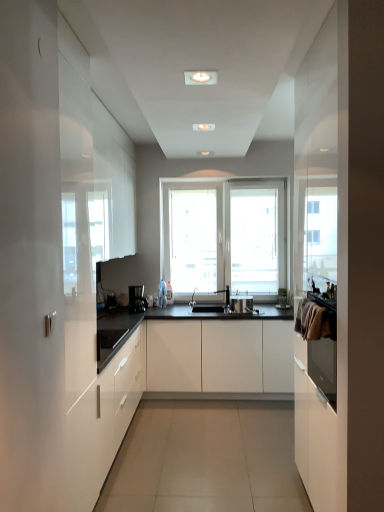
Locate an element on the screen. This screenshot has height=512, width=384. black plastic coffee machine at center is located at coordinates (137, 298).

Locate an element on the screen. This screenshot has width=384, height=512. satin silver toaster at center is located at coordinates 241,304.

You are a GUI agent. You are given a task and a screenshot of the screen. Output one action in this format:
    pyautogui.click(x=<x>, y=<y>)
    Task: Click on the black plastic coffee machine at center
    Image resolution: width=384 pixels, height=512 pixels.
    Given the screenshot: What is the action you would take?
    pyautogui.click(x=137, y=298)

Is white glossy cabinet at left, marked as the second cabinetry in a right-to-left arrangement, wider than satin silver toaster at center?

Indeed, white glossy cabinet at left, marked as the second cabinetry in a right-to-left arrangement, has a greater width compared to satin silver toaster at center.

Between white glossy cabinet at left, the 1th cabinetry in the left-to-right sequence, and satin silver toaster at center, which one has less height?

Standing shorter between the two is satin silver toaster at center.

Is point (92, 416) positioned after point (236, 300)?

No, (92, 416) is closer to viewer.

From the image's perspective, is black plastic coffee machine at center over white glossy cabinet at left, marked as the second cabinetry in a right-to-left arrangement?

Yes, from the image's perspective, black plastic coffee machine at center is over white glossy cabinet at left, marked as the second cabinetry in a right-to-left arrangement.

You are a GUI agent. You are given a task and a screenshot of the screen. Output one action in this format:
    pyautogui.click(x=<x>, y=<y>)
    Task: Click on the cabinetry that is the 2nd one when counting forward from the black plastic coffee machine at center
    This screenshot has width=384, height=512.
    Given the screenshot: What is the action you would take?
    pyautogui.click(x=104, y=420)

In terms of width, does black plastic coffee machine at center look wider or thinner when compared to white glossy cabinet at left, the 1th cabinetry in the left-to-right sequence?

black plastic coffee machine at center is thinner than white glossy cabinet at left, the 1th cabinetry in the left-to-right sequence.

Is satin silver toaster at center not inside white glossy cabinet at left, marked as the second cabinetry in a right-to-left arrangement?

Yes, satin silver toaster at center is not within white glossy cabinet at left, marked as the second cabinetry in a right-to-left arrangement.

From the image's perspective, relative to white glossy cabinet at left, marked as the second cabinetry in a right-to-left arrangement, is satin silver toaster at center above or below?

satin silver toaster at center is above white glossy cabinet at left, marked as the second cabinetry in a right-to-left arrangement.

From a real-world perspective, relative to white glossy cabinet at left, the 1th cabinetry in the left-to-right sequence, is satin silver toaster at center vertically above or below?

satin silver toaster at center is situated higher than white glossy cabinet at left, the 1th cabinetry in the left-to-right sequence, in the real world.

Is white matte cabinet at center, which is the first cabinetry in right-to-left order, closer to the viewer compared to black plastic coffee machine at center?

Yes, white matte cabinet at center, which is the first cabinetry in right-to-left order, is closer to the camera.

Is white matte cabinet at center, which is the second cabinetry in left-to-right order, aimed at black plastic coffee machine at center?

No, white matte cabinet at center, which is the second cabinetry in left-to-right order, is not facing towards black plastic coffee machine at center.

Considering the positions of objects white matte cabinet at center, which is the first cabinetry in right-to-left order, and black plastic coffee machine at center in the image provided, who is more to the left, white matte cabinet at center, which is the first cabinetry in right-to-left order, or black plastic coffee machine at center?

Positioned to the left is black plastic coffee machine at center.

Based on the photo, is white glossy cabinet at left, marked as the second cabinetry in a right-to-left arrangement, inside white matte cabinet at center, which is the second cabinetry in left-to-right order?

No, white glossy cabinet at left, marked as the second cabinetry in a right-to-left arrangement, is not a part of white matte cabinet at center, which is the second cabinetry in left-to-right order.

Between white matte cabinet at center, which is the first cabinetry in right-to-left order, and white glossy cabinet at left, the 1th cabinetry in the left-to-right sequence, which one is positioned behind?

white matte cabinet at center, which is the first cabinetry in right-to-left order, is further from the camera.

Considering the positions of points (151, 378) and (79, 486), is point (151, 378) closer to camera compared to point (79, 486)?

That is False.

Which object is positioned more to the right, white matte cabinet at center, which is the first cabinetry in right-to-left order, or white glossy cabinet at left, marked as the second cabinetry in a right-to-left arrangement?

Positioned to the right is white matte cabinet at center, which is the first cabinetry in right-to-left order.

Considering the sizes of objects white glossy cabinet at left, the 1th cabinetry in the left-to-right sequence, and white matte cabinet at center, which is the first cabinetry in right-to-left order, in the image provided, who is thinner, white glossy cabinet at left, the 1th cabinetry in the left-to-right sequence, or white matte cabinet at center, which is the first cabinetry in right-to-left order,?

With smaller width is white glossy cabinet at left, the 1th cabinetry in the left-to-right sequence.

Consider the image. Between white glossy cabinet at left, the 1th cabinetry in the left-to-right sequence, and white matte cabinet at center, which is the second cabinetry in left-to-right order, which one has smaller size?

With smaller size is white glossy cabinet at left, the 1th cabinetry in the left-to-right sequence.

Does point (115, 392) appear closer or farther from the camera than point (205, 326)?

Clearly, point (115, 392) is closer to the camera than point (205, 326).

Is white glossy cabinet at left, the 1th cabinetry in the left-to-right sequence, with white matte cabinet at center, which is the first cabinetry in right-to-left order?

No, white glossy cabinet at left, the 1th cabinetry in the left-to-right sequence, is not next to white matte cabinet at center, which is the first cabinetry in right-to-left order.

Is point (246, 298) positioned in front of point (139, 296)?

No, (246, 298) is behind (139, 296).

Which of these two, satin silver toaster at center or black plastic coffee machine at center, is wider?

satin silver toaster at center is wider.

In terms of size, does satin silver toaster at center appear bigger or smaller than black plastic coffee machine at center?

In the image, satin silver toaster at center appears to be larger than black plastic coffee machine at center.

Locate an element on the screen. The height and width of the screenshot is (512, 384). appliance lying on the right of white glossy cabinet at left, marked as the second cabinetry in a right-to-left arrangement is located at coordinates (241, 304).

At what (x,y) coordinates should I click in order to perform the action: click on cabinetry that is the 1st object directly below the black plastic coffee machine at center (from a real-world perspective). Please return your answer as a coordinate pair (x, y). Looking at the image, I should click on (104, 420).

Which object lies nearer to the anchor point black plastic coffee machine at center, satin silver toaster at center or white matte cabinet at center, which is the first cabinetry in right-to-left order?

white matte cabinet at center, which is the first cabinetry in right-to-left order.

Based on their spatial positions, is white glossy cabinet at left, the 1th cabinetry in the left-to-right sequence, or white matte cabinet at center, which is the second cabinetry in left-to-right order, further from black plastic coffee machine at center?

Based on the image, white glossy cabinet at left, the 1th cabinetry in the left-to-right sequence, appears to be further to black plastic coffee machine at center.

Which object lies nearer to the anchor point white matte cabinet at center, which is the first cabinetry in right-to-left order, satin silver toaster at center or black plastic coffee machine at center?

satin silver toaster at center.

Based on their spatial positions, is white matte cabinet at center, which is the second cabinetry in left-to-right order, or satin silver toaster at center closer to white glossy cabinet at left, the 1th cabinetry in the left-to-right sequence?

The object closer to white glossy cabinet at left, the 1th cabinetry in the left-to-right sequence, is white matte cabinet at center, which is the second cabinetry in left-to-right order.

Considering their positions, is white glossy cabinet at left, marked as the second cabinetry in a right-to-left arrangement, positioned closer to satin silver toaster at center than white matte cabinet at center, which is the second cabinetry in left-to-right order?

white matte cabinet at center, which is the second cabinetry in left-to-right order, is positioned closer to the anchor satin silver toaster at center.

When comparing their distances from satin silver toaster at center, does black plastic coffee machine at center or white glossy cabinet at left, the 1th cabinetry in the left-to-right sequence, seem further?

white glossy cabinet at left, the 1th cabinetry in the left-to-right sequence.

Based on their spatial positions, is black plastic coffee machine at center or white matte cabinet at center, which is the second cabinetry in left-to-right order, closer to satin silver toaster at center?

white matte cabinet at center, which is the second cabinetry in left-to-right order, is closer to satin silver toaster at center.

Estimate the real-world distances between objects in this image. Which object is closer to black plastic coffee machine at center, white matte cabinet at center, which is the second cabinetry in left-to-right order, or white glossy cabinet at left, the 1th cabinetry in the left-to-right sequence?

white matte cabinet at center, which is the second cabinetry in left-to-right order, lies closer to black plastic coffee machine at center than the other object.

Where is `cabinetry positioned between white glossy cabinet at left, marked as the second cabinetry in a right-to-left arrangement, and black plastic coffee machine at center from near to far`? The height and width of the screenshot is (512, 384). cabinetry positioned between white glossy cabinet at left, marked as the second cabinetry in a right-to-left arrangement, and black plastic coffee machine at center from near to far is located at coordinates pyautogui.click(x=220, y=356).

The width and height of the screenshot is (384, 512). What are the coordinates of `appliance positioned between white glossy cabinet at left, the 1th cabinetry in the left-to-right sequence, and black plastic coffee machine at center from near to far` in the screenshot? It's located at pyautogui.click(x=241, y=304).

Locate an element on the screen. cabinetry between black plastic coffee machine at center and satin silver toaster at center in the horizontal direction is located at coordinates (220, 356).

Where is `cabinetry between white glossy cabinet at left, marked as the second cabinetry in a right-to-left arrangement, and satin silver toaster at center from front to back`? cabinetry between white glossy cabinet at left, marked as the second cabinetry in a right-to-left arrangement, and satin silver toaster at center from front to back is located at coordinates (220, 356).